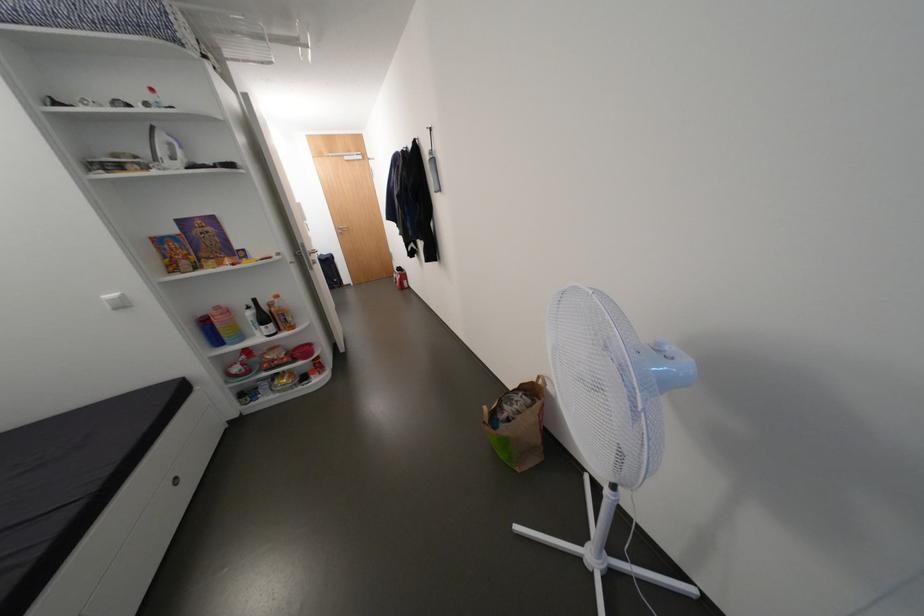
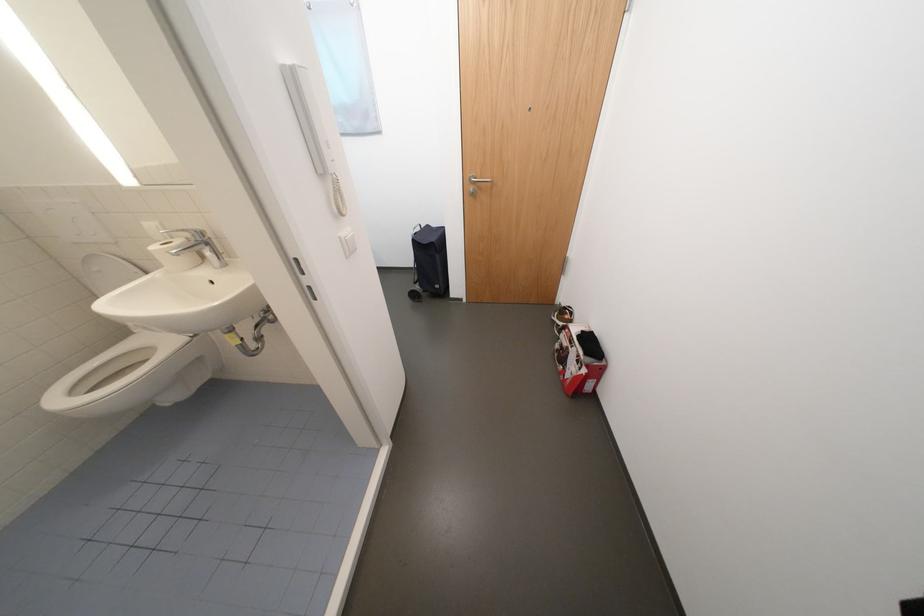
The point at [407,277] is marked in the first image. Where is the corresponding point in the second image?

(592, 371)